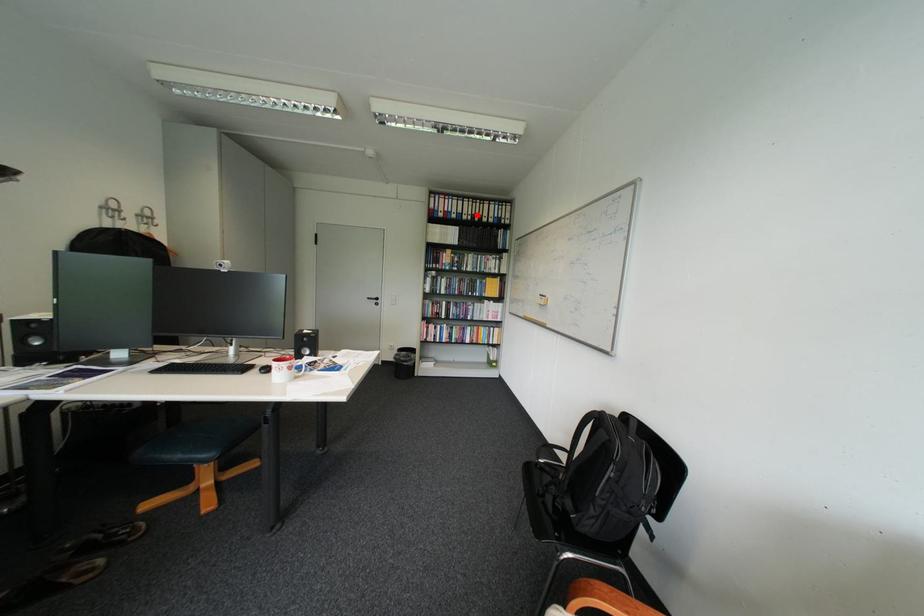
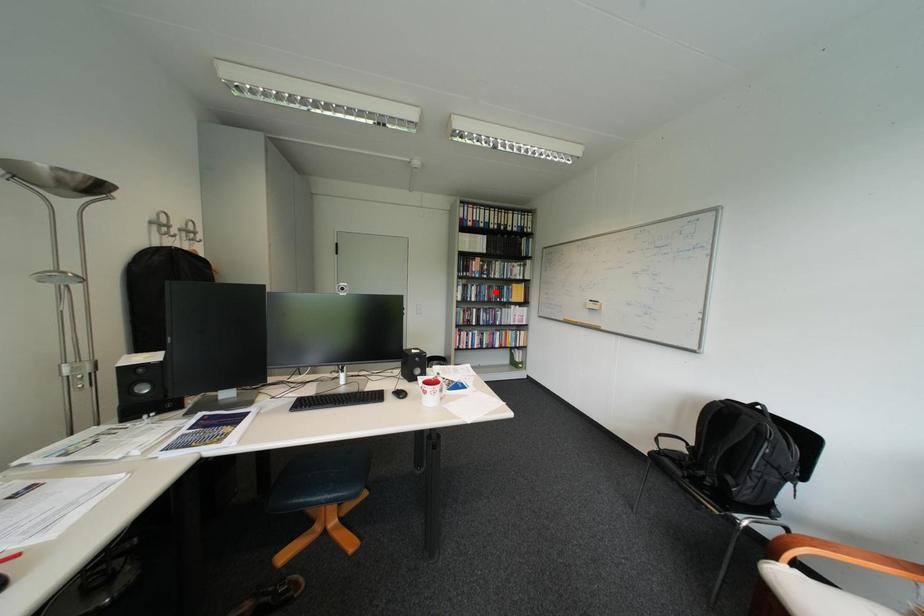
I am providing you with two images of the same scene from different viewpoints. A red point is marked on the first image and another point is marked on the second image. Do the highlighted points in image1 and image2 indicate the same real-world spot?

No